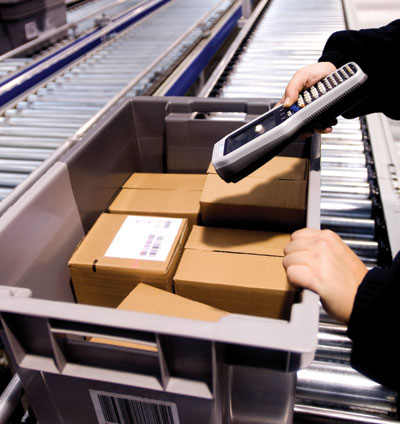
Image resolution: width=400 pixels, height=424 pixels. I want to click on box, so click(221, 293).